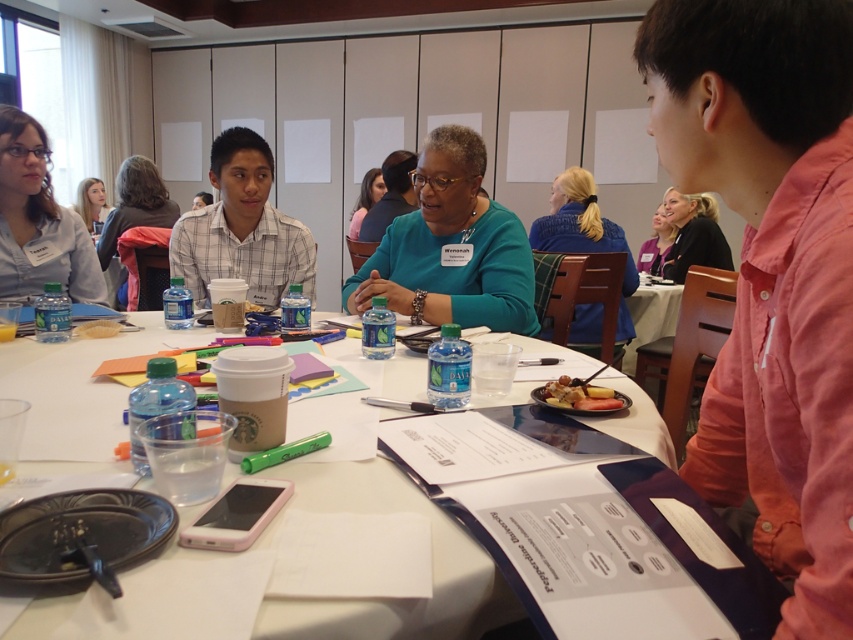
Is matte blue shirt at upper left to the right of matte black hair at upper left from the viewer's perspective?

Yes, matte blue shirt at upper left is to the right of matte black hair at upper left.

Which is more to the right, matte blue shirt at upper left or matte black hair at upper left?

Positioned to the right is matte blue shirt at upper left.

Between point (25, 160) and point (85, 188), which one is positioned behind?

The point (85, 188) is more distant.

Where is `matte blue shirt at upper left`? Image resolution: width=853 pixels, height=640 pixels. matte blue shirt at upper left is located at coordinates (38, 220).

Does green matte sweater at center come behind translucent plastic bag at table center?

Yes.

Who is positioned more to the left, green matte sweater at center or translucent plastic bag at table center?

translucent plastic bag at table center is more to the left.

Which is behind, point (367, 204) or point (73, 330)?

The point (367, 204) is more distant.

Locate an element on the screen. The image size is (853, 640). green matte sweater at center is located at coordinates (364, 198).

Is teal fabric shirt at center thinner than matte black hair at upper left?

No.

Is point (485, 241) farther from viewer compared to point (78, 211)?

No, (485, 241) is in front of (78, 211).

I want to click on teal fabric shirt at center, so click(x=451, y=248).